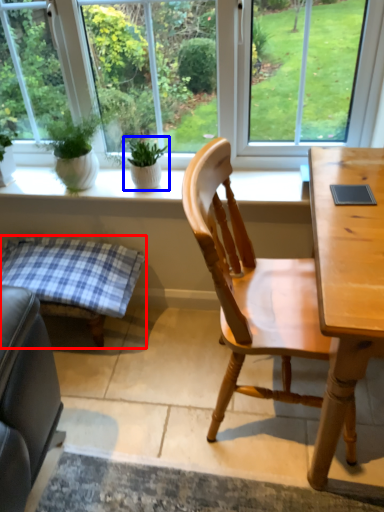
Question: Which object appears closest to the camera in this image, table (highlighted by a red box) or houseplant (highlighted by a blue box)?

Choices:
 (A) table
 (B) houseplant

Answer: (A)